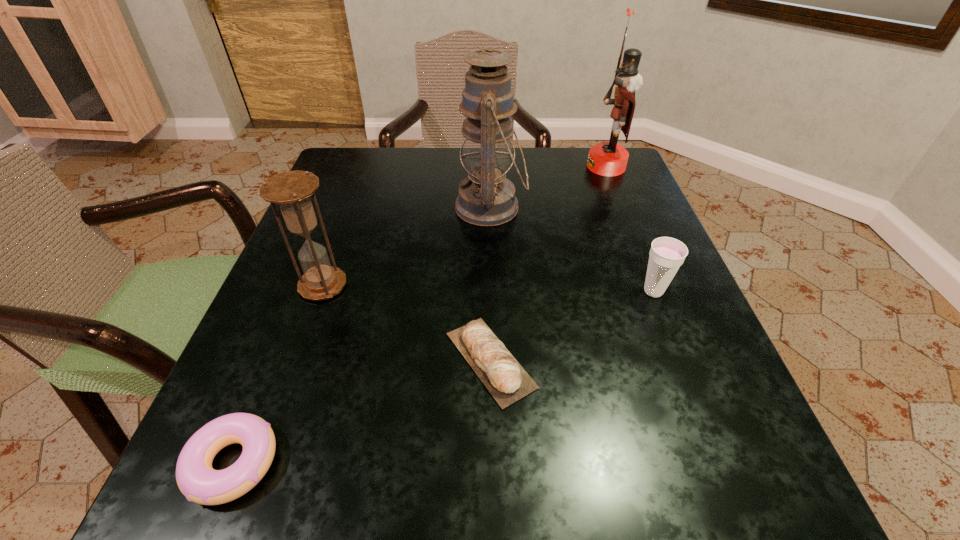
At what (x,y) coordinates should I click in order to perform the action: click on nutcracker. Please return your answer as a coordinate pair (x, y). The image size is (960, 540). Looking at the image, I should click on (606, 158).

This screenshot has width=960, height=540. In order to click on the second farthest object in this screenshot , I will do `click(486, 197)`.

The image size is (960, 540). I want to click on hourglass, so click(x=291, y=190).

I want to click on the third shortest object, so click(x=667, y=254).

Where is `pita bread`? pita bread is located at coordinates (495, 366).

Find the location of a particular element. The image size is (960, 540). the nearest object is located at coordinates (197, 480).

The width and height of the screenshot is (960, 540). What are the coordinates of `vacant space situated on the front-facing side of the farthest object` in the screenshot? It's located at (444, 166).

The image size is (960, 540). I want to click on vacant space situated on the front-facing side of the farthest object, so click(441, 166).

Identify the location of vacant space located on the front-facing side of the farthest object. (566, 166).

Identify the location of free space located 0.210m on the front of the oil lamp. (493, 317).